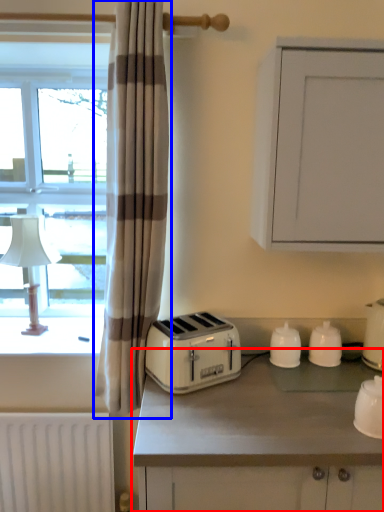
Question: Which point is further to the camera, countertop (highlighted by a red box) or curtain (highlighted by a blue box)?

Choices:
 (A) countertop
 (B) curtain

Answer: (B)